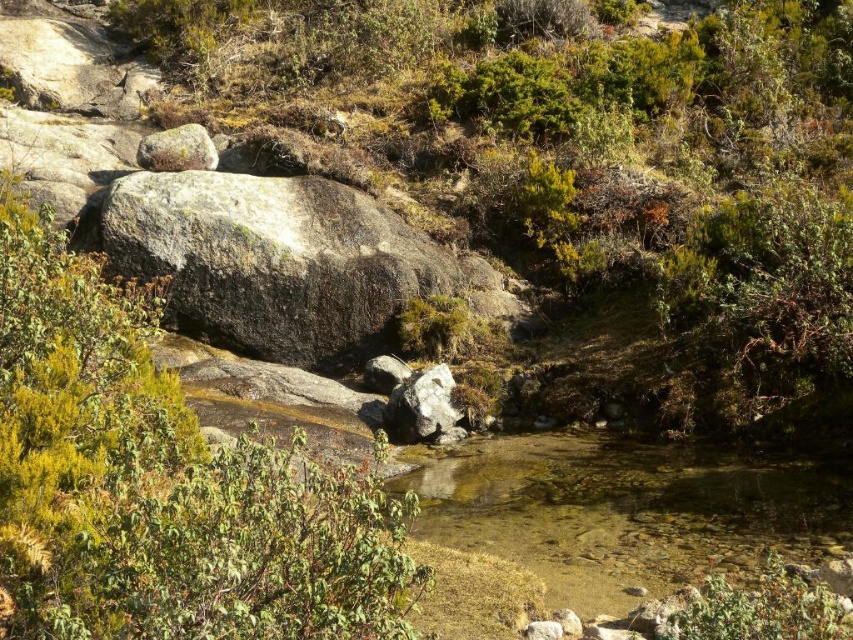
Looking at this image, you are a hiker trying to cross the stream and need to step on the green shrubbery at center and the green leafy shrub at left. Which shrub should you avoid stepping on to minimize damage, considering their sizes?

You should avoid stepping on the green shrubbery at center because it might be wider than the green leafy shrub at left, making it more vulnerable to damage from footsteps.

You are standing at the origin point of the image and want to step into the clear water at center. Which direction should you move to reach it?

The clear water at center is located at point (627, 512) in 2D coordinates, so you should move towards the right and downward from your current position to reach it.